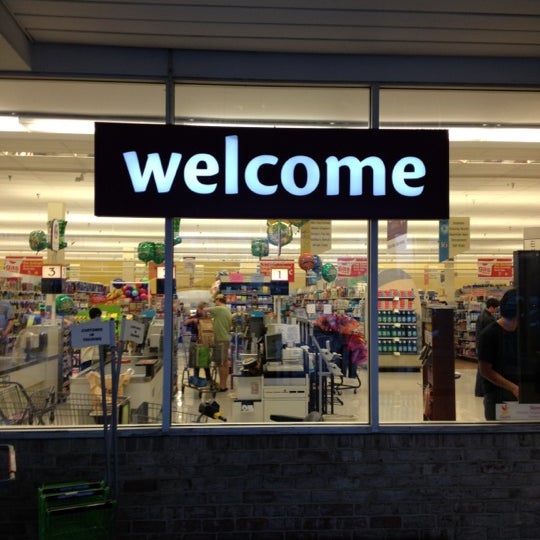
The image size is (540, 540). Identify the location of cash registers. (283, 342), (141, 349).